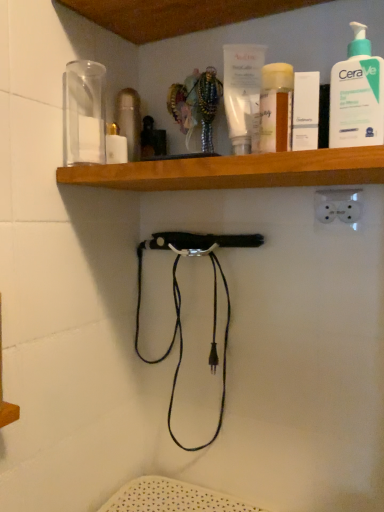
Question: Considering the positions of wooden at upper center and white pump bottle at upper right in the image, is wooden at upper center taller or shorter than white pump bottle at upper right?

Choices:
 (A) tall
 (B) short

Answer: (B)

Question: Relative to white pump bottle at upper right, is wooden at upper center in front or behind?

Choices:
 (A) behind
 (B) front

Answer: (B)

Question: Which is nearer to the white pump bottle at upper right?

Choices:
 (A) white matte box at upper center
 (B) wooden at upper center

Answer: (A)

Question: Considering the real-world distances, which object is closest to the wooden at upper center?

Choices:
 (A) white matte box at upper center
 (B) white pump bottle at upper right

Answer: (A)